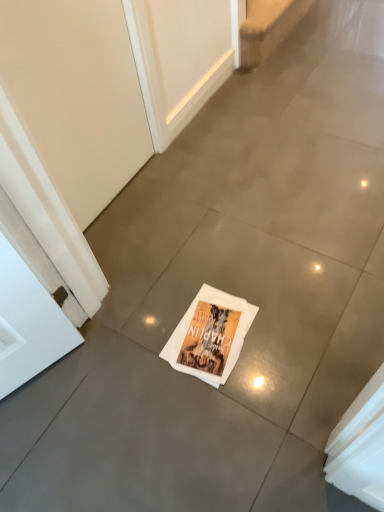
Locate an element on the screen. blank space situated above white paper magazine at center (from a real-world perspective) is located at coordinates (200, 330).